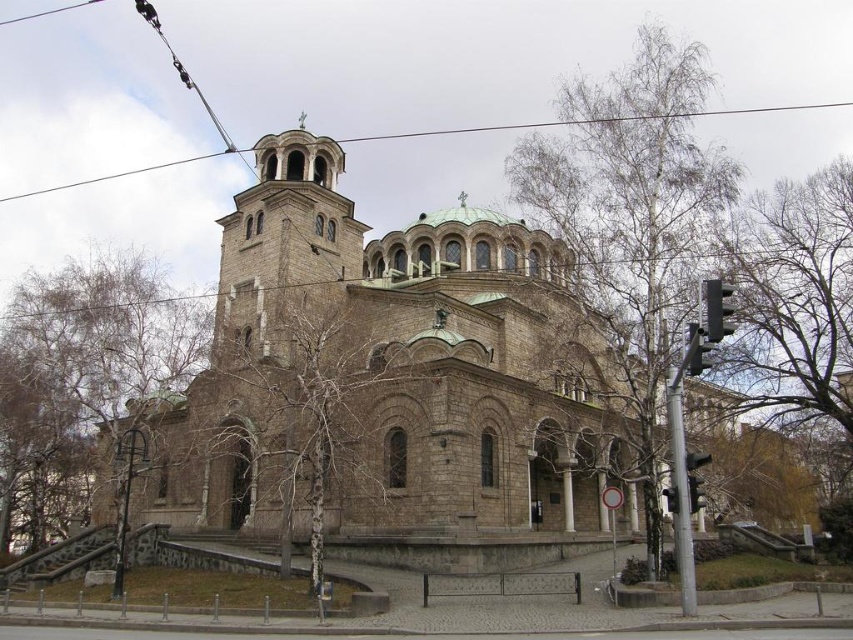
Is brown stone church at center below metallic wire at upper center?

Correct, brown stone church at center is located below metallic wire at upper center.

Can you confirm if brown stone church at center is positioned above metallic wire at upper center?

Actually, brown stone church at center is below metallic wire at upper center.

The height and width of the screenshot is (640, 853). What do you see at coordinates (390, 372) in the screenshot? I see `brown stone church at center` at bounding box center [390, 372].

Where is `brown stone church at center`? brown stone church at center is located at coordinates pos(390,372).